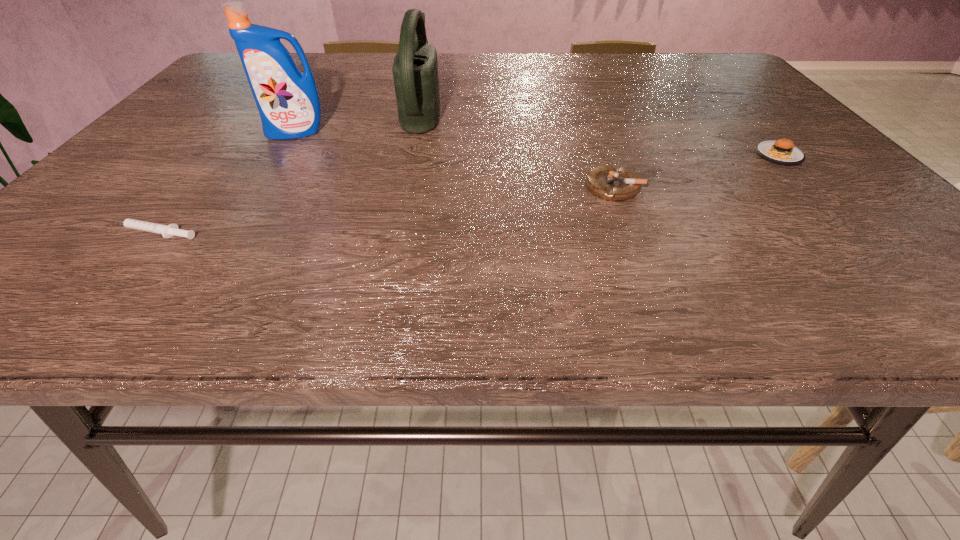
Identify the location of detergent. This screenshot has width=960, height=540. (288, 102).

You are a GUI agent. You are given a task and a screenshot of the screen. Output one action in this format:
    pyautogui.click(x=<x>, y=<y>)
    Task: Click on the watering can
    This screenshot has width=960, height=540.
    Given the screenshot: What is the action you would take?
    pyautogui.click(x=415, y=68)

Identify the location of the third object from right to left. The width and height of the screenshot is (960, 540). (415, 68).

You are a GUI agent. You are given a task and a screenshot of the screen. Output one action in this format:
    pyautogui.click(x=<x>, y=<y>)
    Task: Click on the rightmost object
    
    Given the screenshot: What is the action you would take?
    pyautogui.click(x=782, y=152)

Where is `ashtray`? This screenshot has height=540, width=960. ashtray is located at coordinates pos(609,183).

Image resolution: width=960 pixels, height=540 pixels. What are the coordinates of `the fourth object from left to right` in the screenshot? It's located at (609, 183).

Image resolution: width=960 pixels, height=540 pixels. Find the location of `the nearest object`. the nearest object is located at coordinates (167, 231).

Find the location of a particular element. This screenshot has width=960, height=540. the shortest object is located at coordinates (167, 231).

At what (x,y) coordinates should I click in order to perform the action: click on vacant position located on the label of the detergent. Please return your answer as a coordinate pair (x, y). Looking at the image, I should click on (216, 262).

This screenshot has width=960, height=540. Identify the location of vacant space located on the spout of the watering can. (462, 110).